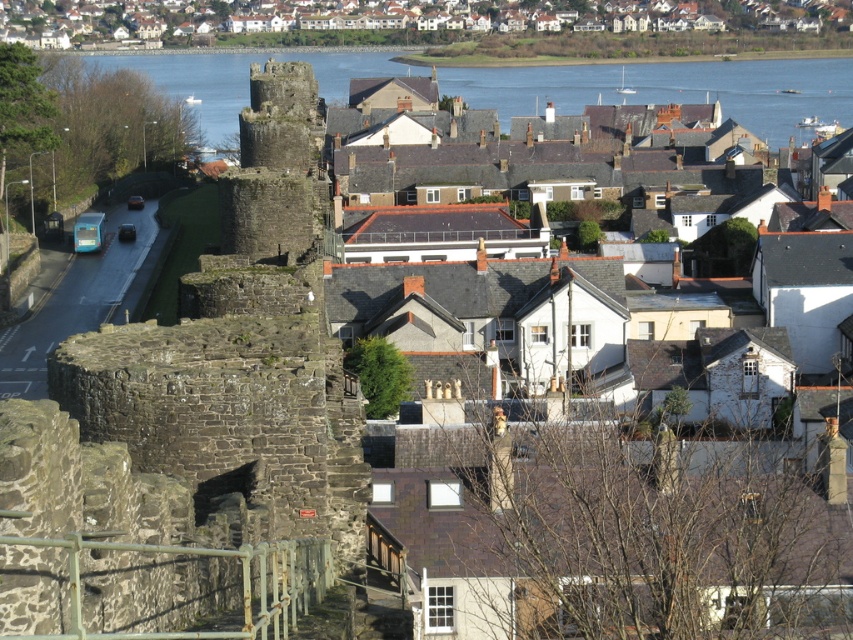
Question: Does clear blue water at upper center have a greater width compared to blue concrete road at left?

Choices:
 (A) yes
 (B) no

Answer: (A)

Question: Among these objects, which one is farthest from the camera?

Choices:
 (A) blue concrete road at left
 (B) clear blue water at upper center
 (C) rusty stone castle at center

Answer: (B)

Question: Which point is farther from the camera taking this photo?

Choices:
 (A) (57, 337)
 (B) (167, 481)
 (C) (361, 52)

Answer: (C)

Question: Can you confirm if white textured houses at upper center is positioned to the right of clear blue water at upper center?

Choices:
 (A) no
 (B) yes

Answer: (A)

Question: Is rusty stone castle at center smaller than clear blue water at upper center?

Choices:
 (A) no
 (B) yes

Answer: (B)

Question: Among these objects, which one is farthest from the camera?

Choices:
 (A) rusty stone castle at center
 (B) blue concrete road at left

Answer: (B)